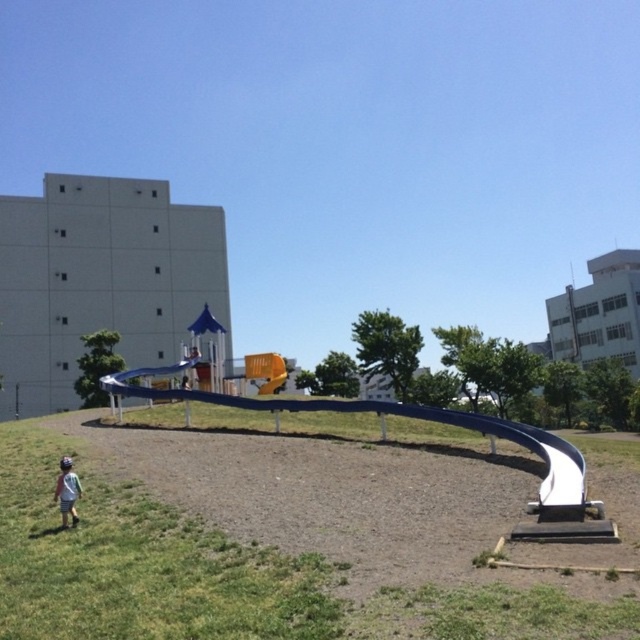
Is green grass at lower left shorter than light blue denim shorts at lower left?

Indeed, green grass at lower left has a lesser height compared to light blue denim shorts at lower left.

Between point (173, 541) and point (76, 493), which one is positioned in front?

Point (173, 541) is more forward.

Where is `green grass at lower left`? The width and height of the screenshot is (640, 640). green grass at lower left is located at coordinates (250, 564).

Is point (128, 380) closer to camera compared to point (77, 481)?

No.

Who is more forward, (419, 412) or (60, 497)?

Point (60, 497) is in front.

Find the location of `blue rubber slide at center`. blue rubber slide at center is located at coordinates (381, 417).

At what (x,y) coordinates should I click in order to perform the action: click on blue rubber slide at center. Please return your answer as a coordinate pair (x, y). The image size is (640, 640). Looking at the image, I should click on (381, 417).

How distant is green grass at lower left from blue rubber slide at center?

The distance of green grass at lower left from blue rubber slide at center is 4.68 meters.

Consider the image. Who is more forward, (456,547) or (570,480)?

Positioned in front is point (456,547).

At what (x,y) coordinates should I click in order to perform the action: click on green grass at lower left. Please return your answer as a coordinate pair (x, y). Looking at the image, I should click on (250, 564).